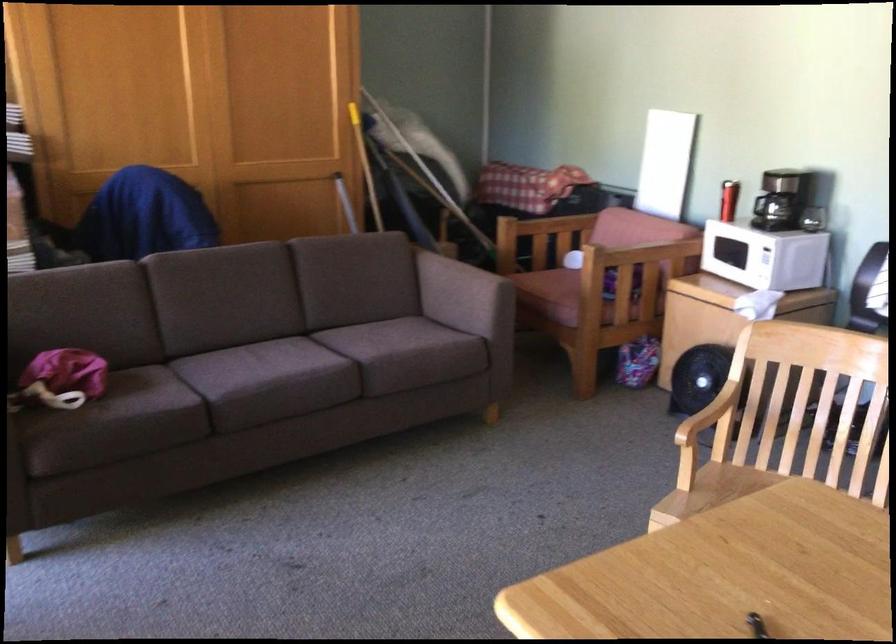
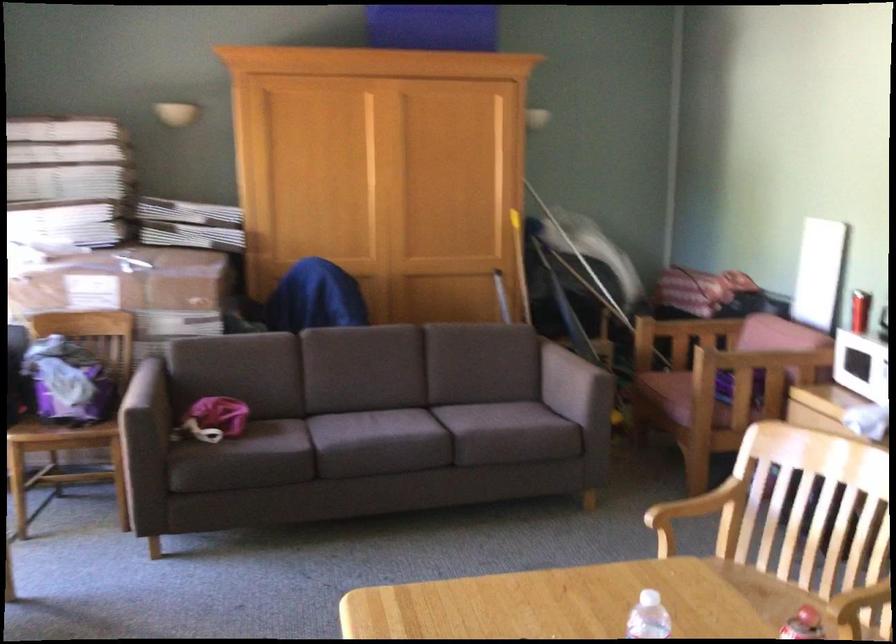
Question: The images are taken continuously from a first-person perspective. In which direction are you moving?

Choices:
 (A) Left
 (B) Right
 (C) Forward
 (D) Backward

Answer: (B)